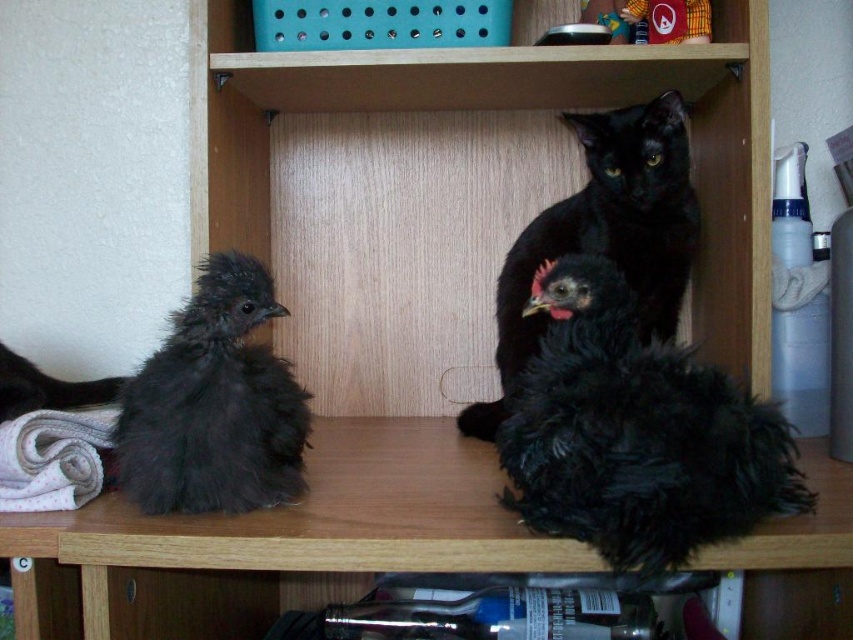
You are a photographer standing 30 inches away from a wooden shelf. You see the dark fluffy chicken at left. Can you take a clear photo of it without moving closer?

The dark fluffy chicken at left is 28.70 inches away from the camera. Since you are standing 30 inches away, you are slightly farther than the chicken, so you can take a clear photo without moving closer.

You are a photographer trying to capture a clear shot of the dark fluffy chicken at left and the smooth yellow fabric at upper center. Since you want both subjects in focus, which one should you adjust your camera focus on first to ensure the closest subject is sharp?

You should focus on the dark fluffy chicken at left first because it is closer to the viewer than the smooth yellow fabric at upper center.

In the scene shown: You are a toy maker who wants to place a new toy between the black fluffy cat at upper center and the smooth yellow fabric at upper center. The toy is 9 inches long. Will it fit without overlapping either object?

The distance between the black fluffy cat at upper center and the smooth yellow fabric at upper center is 10.01 inches. Since the toy is 9 inches long, it will fit as there is enough space between them.